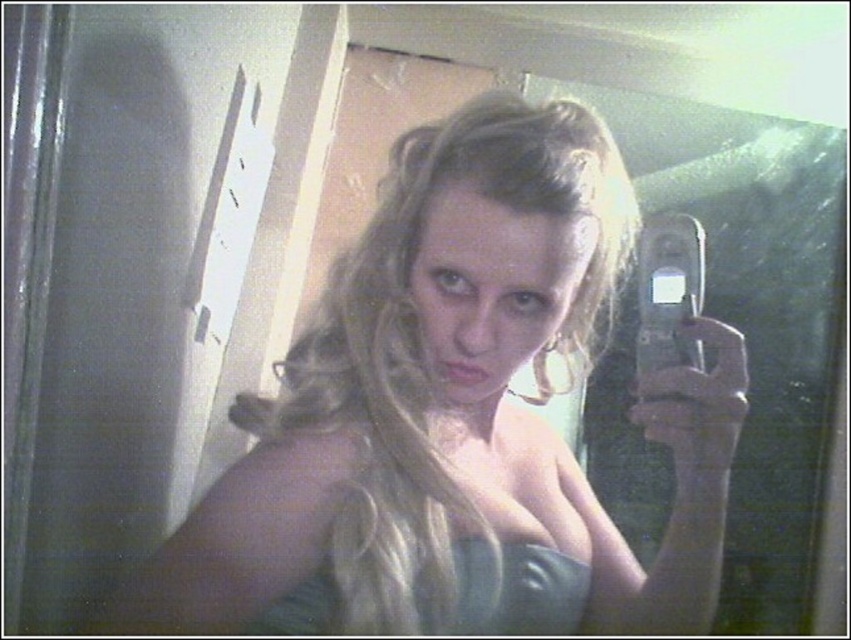
You are trying to decide which blue dress to wear for an event. You have two options in front of you in the image, the matte blue dress at center and the satin blue dress at center. Based on their positions in the image, which dress is positioned higher?

The matte blue dress at center is located above the satin blue dress at center, so the matte blue dress at center is positioned higher.

You are analyzing a selfie photo taken with a flip phone. You notice two points marked in the image at coordinates point (669,438) and point (561,612). Based on the perspective in the photo, which point is closer to the viewer?

Point (669,438) is closer to the viewer than point (561,612).